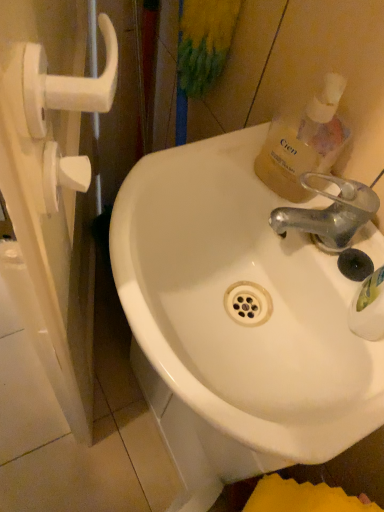
Question: Should I look upward or downward to see white glossy sink at center?

Choices:
 (A) down
 (B) up

Answer: (A)

Question: Would you say white plastic handle at left contains white glossy sink at center?

Choices:
 (A) yes
 (B) no

Answer: (B)

Question: Does white plastic handle at left have a greater width compared to white glossy sink at center?

Choices:
 (A) no
 (B) yes

Answer: (A)

Question: Is white plastic handle at left behind white glossy sink at center?

Choices:
 (A) yes
 (B) no

Answer: (B)

Question: Considering the relative sizes of white plastic handle at left and white glossy sink at center in the image provided, is white plastic handle at left thinner than white glossy sink at center?

Choices:
 (A) no
 (B) yes

Answer: (B)

Question: Does white plastic handle at left appear on the left side of white glossy sink at center?

Choices:
 (A) no
 (B) yes

Answer: (B)

Question: Is white plastic handle at left not close to white glossy sink at center?

Choices:
 (A) no
 (B) yes

Answer: (A)

Question: Is white plastic handle at left not near metallic silver faucet at upper right?

Choices:
 (A) no
 (B) yes

Answer: (A)

Question: From the image's perspective, does white plastic handle at left appear lower than metallic silver faucet at upper right?

Choices:
 (A) yes
 (B) no

Answer: (B)

Question: Does white plastic handle at left lie behind metallic silver faucet at upper right?

Choices:
 (A) yes
 (B) no

Answer: (B)

Question: Considering the relative sizes of white plastic handle at left and metallic silver faucet at upper right in the image provided, is white plastic handle at left shorter than metallic silver faucet at upper right?

Choices:
 (A) no
 (B) yes

Answer: (A)

Question: Can you confirm if white plastic handle at left is bigger than metallic silver faucet at upper right?

Choices:
 (A) yes
 (B) no

Answer: (A)

Question: Is white plastic handle at left looking in the opposite direction of metallic silver faucet at upper right?

Choices:
 (A) yes
 (B) no

Answer: (A)

Question: Does white glossy sink at center have a greater width compared to metallic silver faucet at upper right?

Choices:
 (A) no
 (B) yes

Answer: (B)